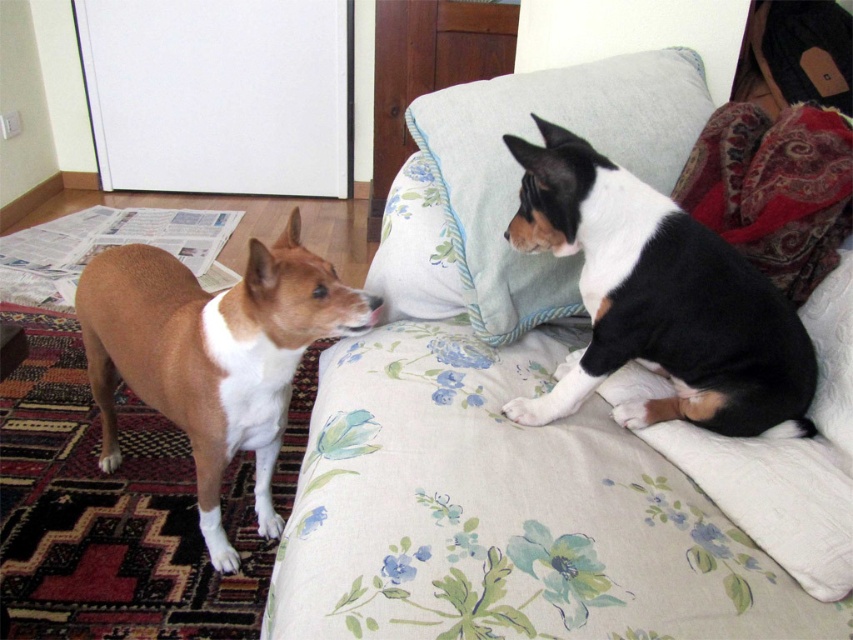
Question: Can you confirm if brown matte dog at left is bigger than fluffy fabric pillow at upper center?

Choices:
 (A) yes
 (B) no

Answer: (A)

Question: In this image, where is floral fabric couch at upper center located relative to black and white fur at upper right?

Choices:
 (A) below
 (B) above

Answer: (B)

Question: Does floral fabric couch at upper center appear under black and white fur at upper right?

Choices:
 (A) yes
 (B) no

Answer: (B)

Question: Which point is farther from the camera taking this photo?

Choices:
 (A) pyautogui.click(x=215, y=428)
 (B) pyautogui.click(x=640, y=113)
 (C) pyautogui.click(x=799, y=380)
 (D) pyautogui.click(x=379, y=620)

Answer: (B)

Question: Which object is the closest to the fluffy fabric pillow at upper center?

Choices:
 (A) brown matte dog at left
 (B) black and white fur at upper right

Answer: (B)

Question: Which is nearer to the floral fabric couch at upper center?

Choices:
 (A) black and white fur at upper right
 (B) fluffy fabric pillow at upper center
 (C) brown matte dog at left

Answer: (B)